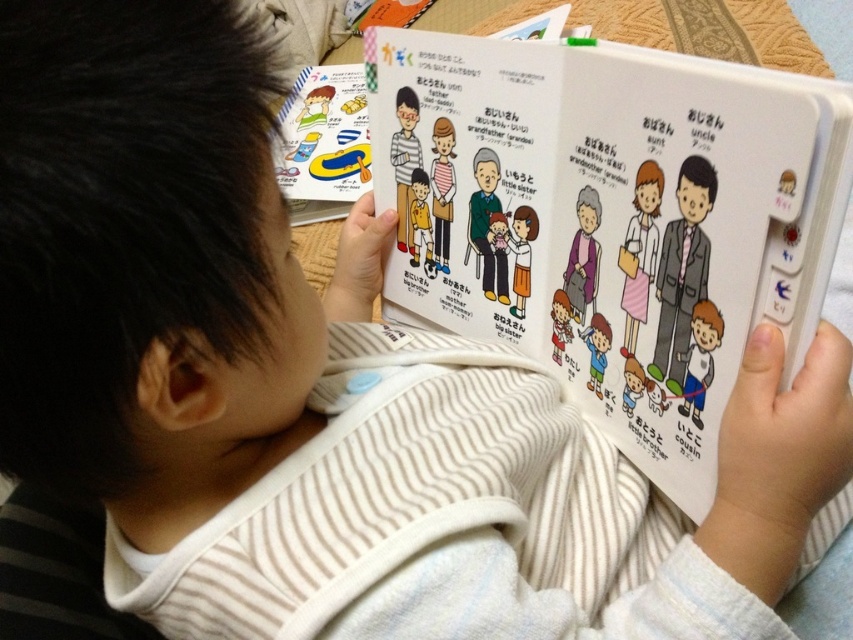
You are a parent trying to choose between the white paper book at center and the purple fabric at center for your child to read. Which item is wider?

The white paper book at center is wider than the purple fabric at center.

You are a parent trying to organize your child room. You see the matte plastic toy boat at upper left and the purple fabric at center. Which object is located above the other?

The matte plastic toy boat at upper left is positioned over purple fabric at center, so it is located above the purple fabric at center.

You are a parent packing for a beach trip and need to decide whether to bring both the matte plastic toy boat at upper left and the matte white dress at center. The beach bag has a width of 20 inches. Can both items fit side by side in the bag?

The matte plastic toy boat at upper left is 26.38 inches from the matte white dress at center. Since the distance between them is greater than the bag width of 20 inches, they cannot fit side by side in the bag.